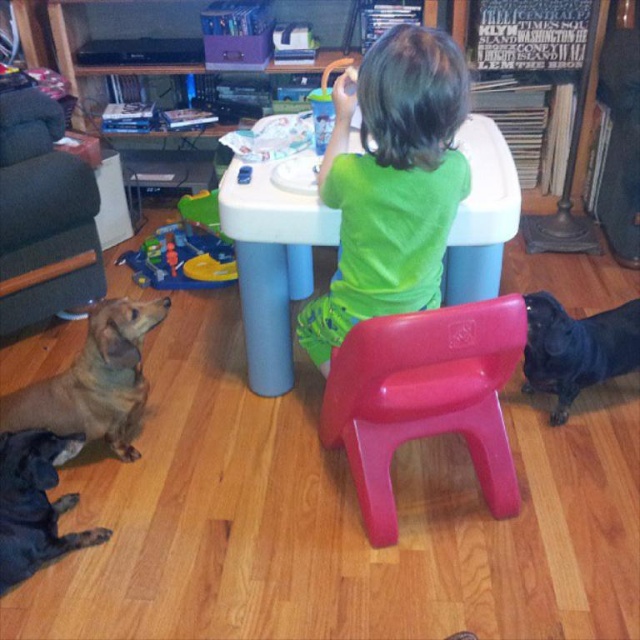
Can you confirm if black smooth dog at lower left is shorter than black glossy dog at lower right?

Yes.

Who is more forward, (13, 493) or (556, 412)?

Positioned in front is point (13, 493).

The height and width of the screenshot is (640, 640). I want to click on black smooth dog at lower left, so click(35, 506).

How distant is green matte shirt at center from brown fur dog at lower left?

green matte shirt at center is 64.47 centimeters from brown fur dog at lower left.

Is green matte shirt at center above brown fur dog at lower left?

Correct, green matte shirt at center is located above brown fur dog at lower left.

Between point (420, 289) and point (80, 355), which one is positioned behind?

The point (80, 355) is more distant.

Where is `green matte shirt at center`? This screenshot has height=640, width=640. green matte shirt at center is located at coordinates (390, 184).

Which is behind, point (340, 332) or point (566, 401)?

The point (566, 401) is more distant.

Which is below, green matte shirt at center or black glossy dog at lower right?

black glossy dog at lower right is lower down.

In order to click on green matte shirt at center in this screenshot , I will do (390, 184).

Identify the location of green matte shirt at center. (390, 184).